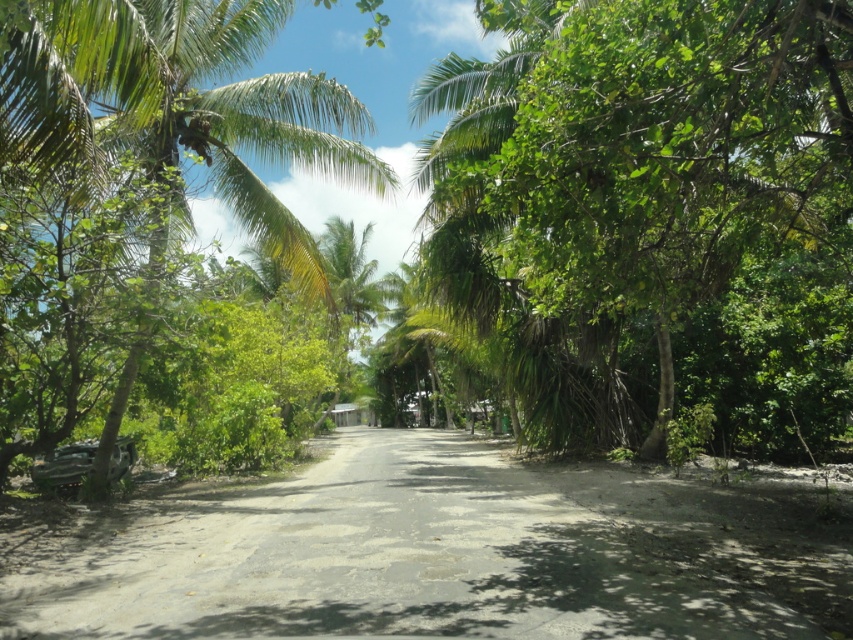
Based on the photo, measure the distance from green leafy palm tree at center to dirt road at center.

green leafy palm tree at center is 3.94 meters away from dirt road at center.

In the scene shown: Who is lower down, green leafy palm tree at center or dirt road at center?

Positioned lower is dirt road at center.

What do you see at coordinates (654, 212) in the screenshot? The width and height of the screenshot is (853, 640). I see `green leafy palm tree at center` at bounding box center [654, 212].

Image resolution: width=853 pixels, height=640 pixels. In order to click on green leafy palm tree at center in this screenshot , I will do `click(654, 212)`.

Looking at this image, between green leafy palm tree at center and green leafy palm tree at left, which one is positioned higher?

green leafy palm tree at center is higher up.

Between green leafy palm tree at center and green leafy palm tree at left, which one appears on the right side from the viewer's perspective?

From the viewer's perspective, green leafy palm tree at center appears more on the right side.

At what (x,y) coordinates should I click in order to perform the action: click on green leafy palm tree at center. Please return your answer as a coordinate pair (x, y). The height and width of the screenshot is (640, 853). Looking at the image, I should click on (654, 212).

Is dirt road at center wider than green leafy palm tree at left?

Correct, the width of dirt road at center exceeds that of green leafy palm tree at left.

You are a GUI agent. You are given a task and a screenshot of the screen. Output one action in this format:
    pyautogui.click(x=<x>, y=<y>)
    Task: Click on the dirt road at center
    
    Given the screenshot: What is the action you would take?
    pyautogui.click(x=433, y=552)